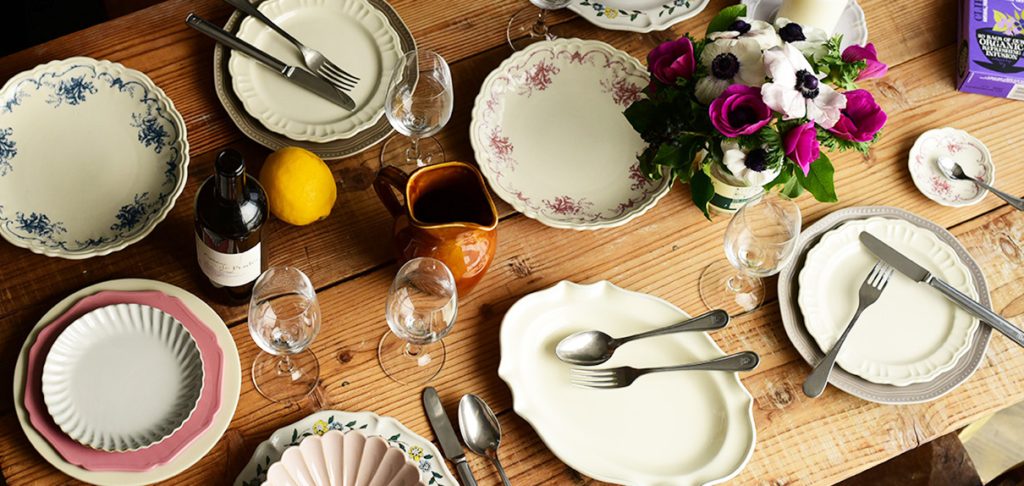
I want to click on silverware, so click(x=443, y=437), click(x=485, y=427), click(x=593, y=339), click(x=607, y=379), click(x=865, y=294), click(x=896, y=257), click(x=948, y=168), click(x=317, y=84), click(x=316, y=69).